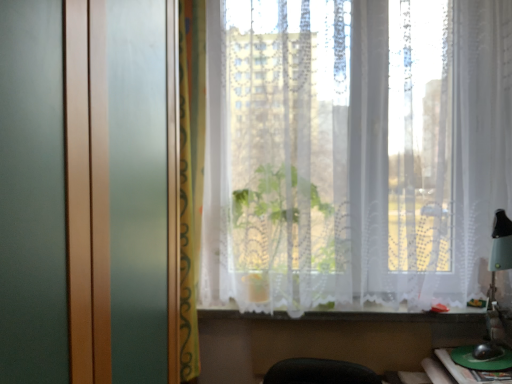
Question: Based on their positions, is white lace curtain at lower center located to the left or right of green plastic table at lower right?

Choices:
 (A) left
 (B) right

Answer: (A)

Question: Considering the positions of white lace curtain at lower center and green plastic table at lower right in the image, is white lace curtain at lower center bigger or smaller than green plastic table at lower right?

Choices:
 (A) small
 (B) big

Answer: (B)

Question: Based on their relative distances, which object is farther from the white lace curtain at center, the 1th curtain viewed from the right?

Choices:
 (A) white lace curtain at lower center
 (B) green plastic table at lower right
 (C) yellow fabric curtain at center, placed as the 2th curtain when sorted from right to left

Answer: (B)

Question: Estimate the real-world distances between objects in this image. Which object is farther from the green plastic table at lower right?

Choices:
 (A) yellow fabric curtain at center, which is counted as the 1th curtain, starting from the left
 (B) white lace curtain at lower center
 (C) white lace curtain at center, the 1th curtain viewed from the right

Answer: (A)